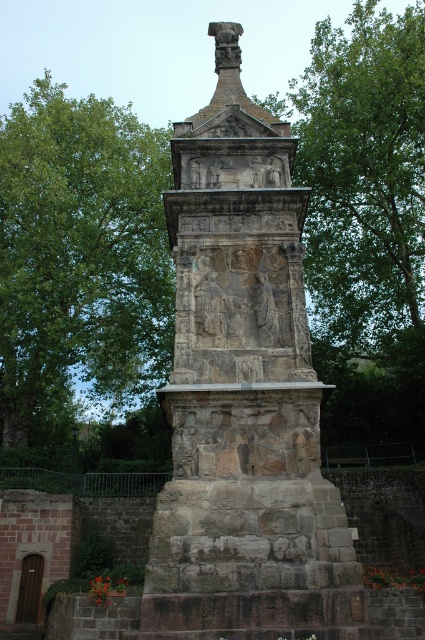
You are standing in front of the historical stone monument and want to know the distance to a specific point marked at coordinates point (257, 371). Can you estimate how far that point is from your current position?

The point (257, 371) is 27.82 meters away from the camera, so the distance from your current position to that point is approximately 27.82 meters.

You are an archaeologist examining the historical stone monument. You notice two elements at the center of the monument. Which one is closer to you, the stone sculpture at center or the stone relief figures at center?

The stone sculpture at center is closer to you because it is positioned in front of the stone relief figures at center.

You are an archaeologist examining the historical stone monument. You notice the green leafy tree at upper left and the stone relief figures at center. Which object is positioned higher up in the image?

The green leafy tree at upper left is located above the stone relief figures at center, so it is positioned higher up in the image.